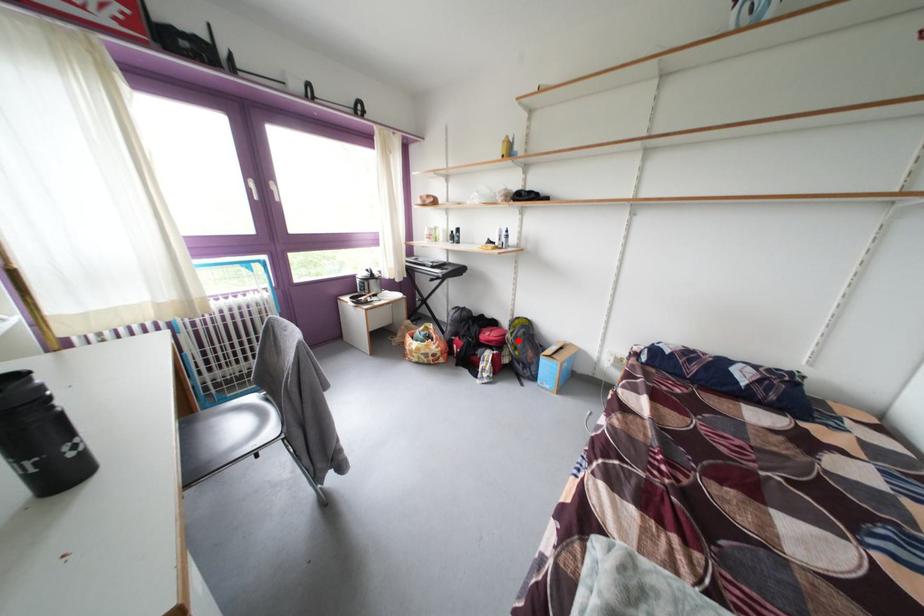
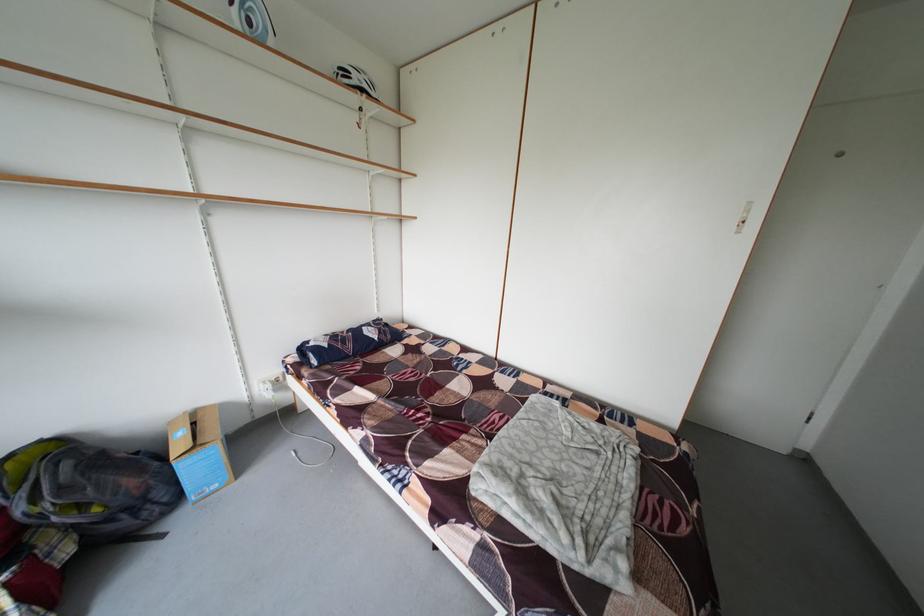
Question: I am providing you with two images of the same scene from different viewpoints. Given a red point in image1, look at the same physical point in image2. Is it:

Choices:
 (A) Closer to the viewpoint
 (B) Farther from the viewpoint

Answer: (A)